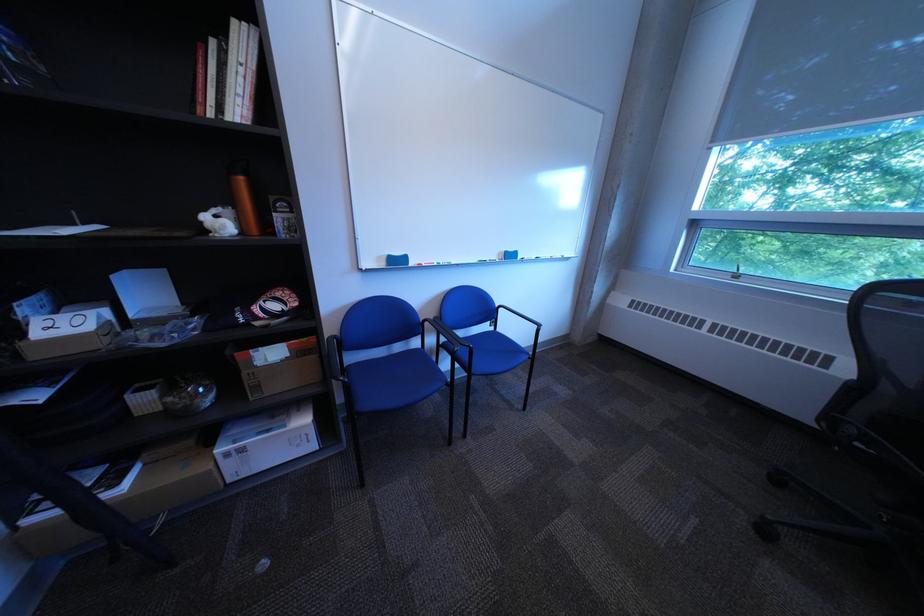
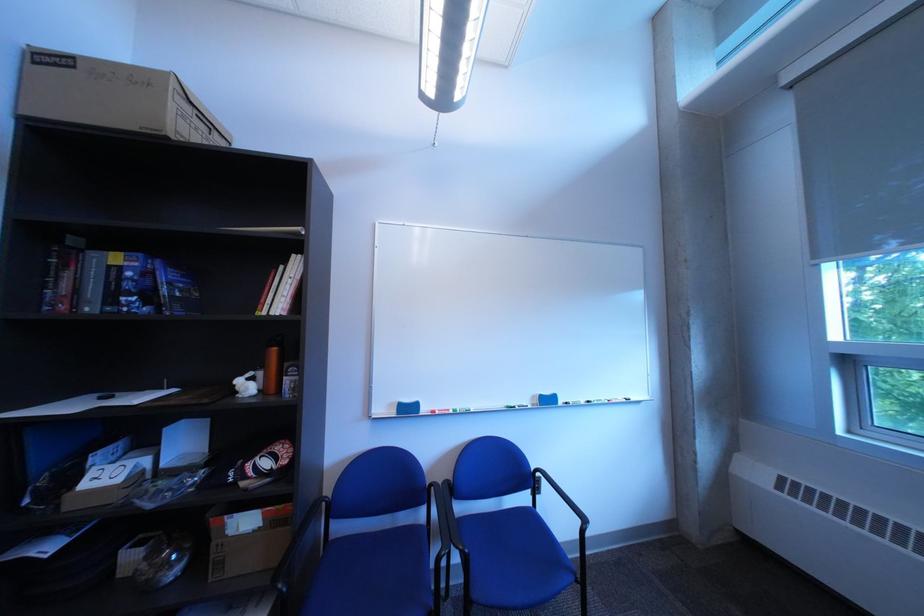
The point at (216, 225) is marked in the first image. Where is the corresponding point in the second image?

(249, 387)